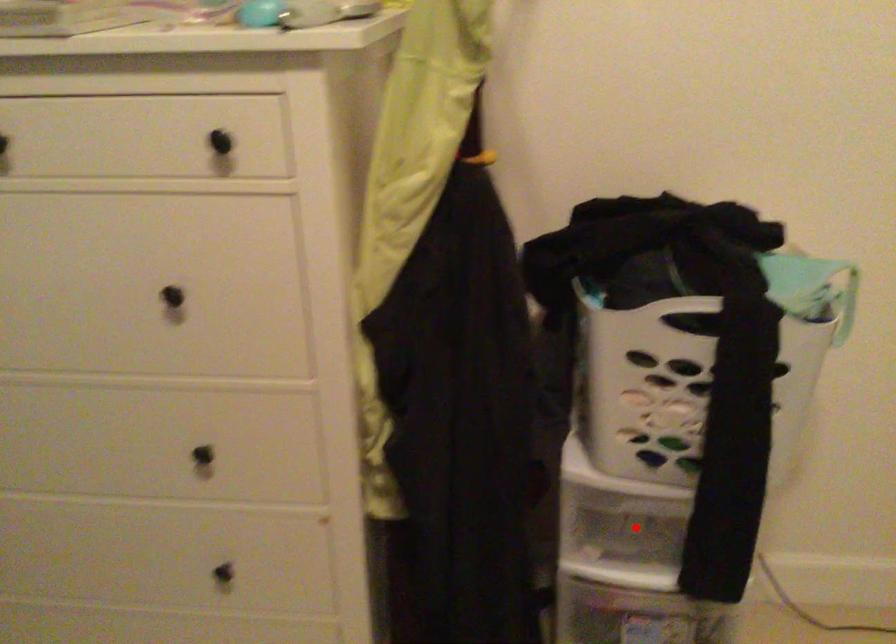
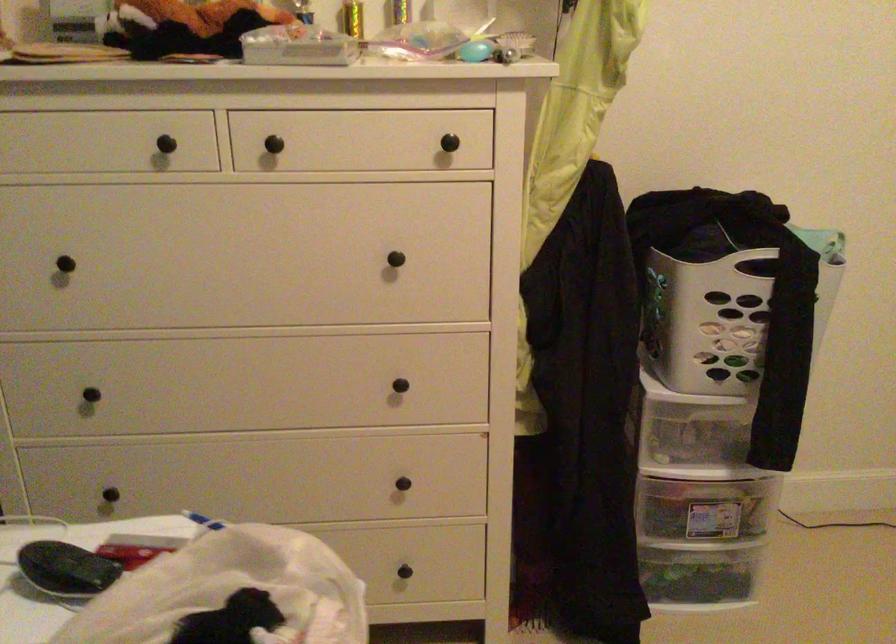
Question: A red point is marked in image1. In image2, is the corresponding 3D point closer to the camera or farther? Reply with the corresponding letter.

Choices:
 (A) The corresponding 3D point is closer.
 (B) The corresponding 3D point is farther.

Answer: (B)